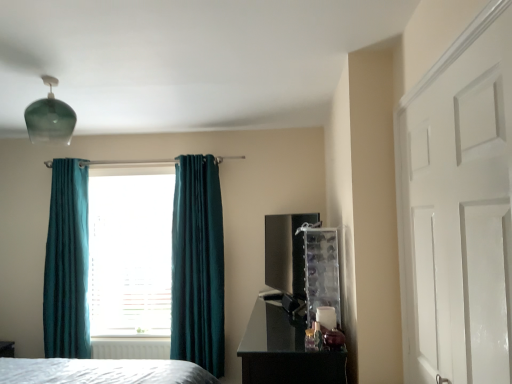
Question: From a real-world perspective, relative to teal velvet curtain at left, the first curtain viewed from the left, is black glossy tv at center-right vertically above or below?

Choices:
 (A) below
 (B) above

Answer: (B)

Question: Is black glossy tv at center-right to the left or to the right of teal velvet curtain at left, the first curtain viewed from the left, in the image?

Choices:
 (A) right
 (B) left

Answer: (A)

Question: Estimate the real-world distances between objects in this image. Which object is farther from the white painted wood door at right?

Choices:
 (A) black glossy tv at center-right
 (B) teal velvet curtain at left, positioned as the second curtain in right-to-left order
 (C) white plastic radiator at lower center
 (D) teal velvet curtain at center, the 2th curtain positioned from the left
 (E) teal fabric curtain at center

Answer: (B)

Question: Considering the real-world distances, which object is farthest from the teal fabric curtain at center?

Choices:
 (A) black glossy tv at center-right
 (B) teal velvet curtain at left, the first curtain viewed from the left
 (C) white plastic radiator at lower center
 (D) glossy black dresser at lower right
 (E) white painted wood door at right

Answer: (E)